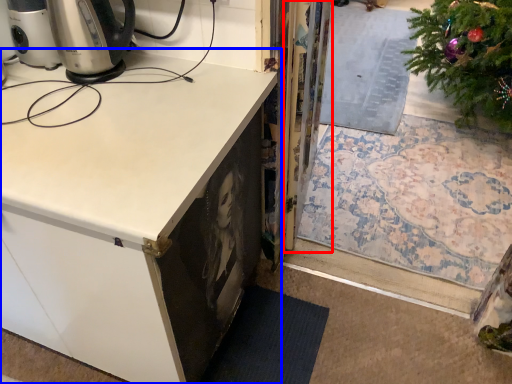
Question: Which of the following is the farthest to the observer, screen door (highlighted by a red box) or cabinetry (highlighted by a blue box)?

Choices:
 (A) screen door
 (B) cabinetry

Answer: (A)